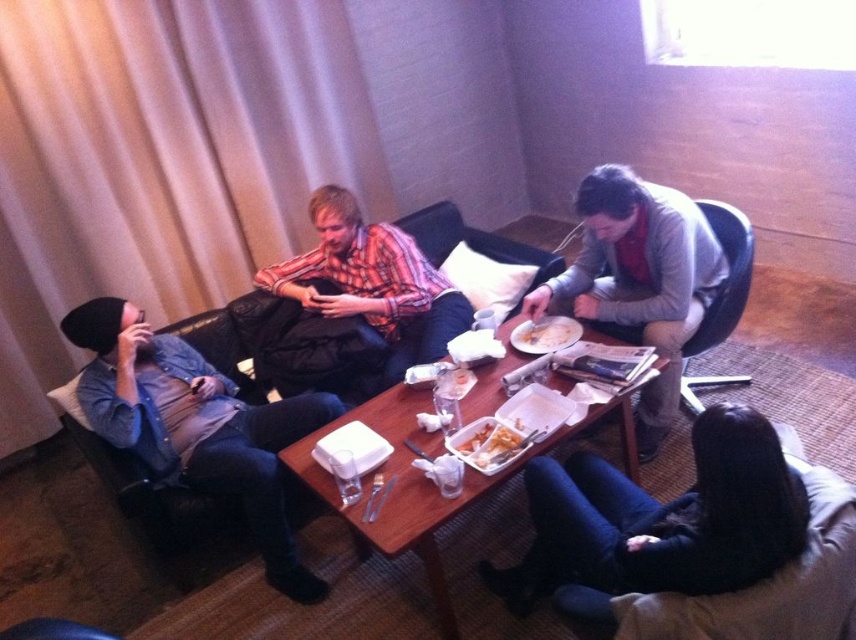
Question: Which point is closer to the camera?

Choices:
 (A) (251, 300)
 (B) (407, 266)

Answer: (B)

Question: Which point is closer to the camera?

Choices:
 (A) (652, 573)
 (B) (482, 394)
 (C) (123, 422)

Answer: (A)

Question: Which of the following is the farthest from the observer?

Choices:
 (A) gray sweater at center
 (B) wooden table at center
 (C) dark blue jeans at lower right
 (D) yellowish matte food at center

Answer: (D)

Question: Does dark blue jeans at lower right come in front of plaid shirt at center?

Choices:
 (A) no
 (B) yes

Answer: (B)

Question: Is plaid shirt at center to the left of gray sweater at center from the viewer's perspective?

Choices:
 (A) no
 (B) yes

Answer: (B)

Question: Where is denim jacket at left located in relation to gray sweater at center in the image?

Choices:
 (A) left
 (B) right

Answer: (A)